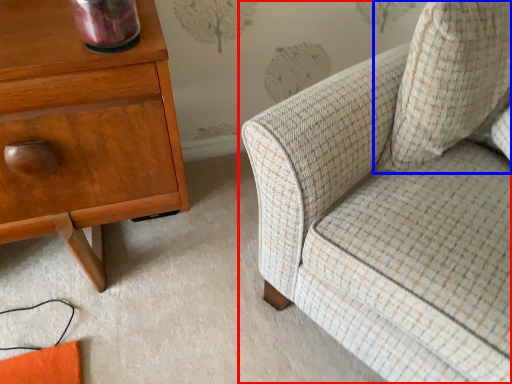
Question: Which object appears farthest to the camera in this image, chair (highlighted by a red box) or throw pillow (highlighted by a blue box)?

Choices:
 (A) chair
 (B) throw pillow

Answer: (B)